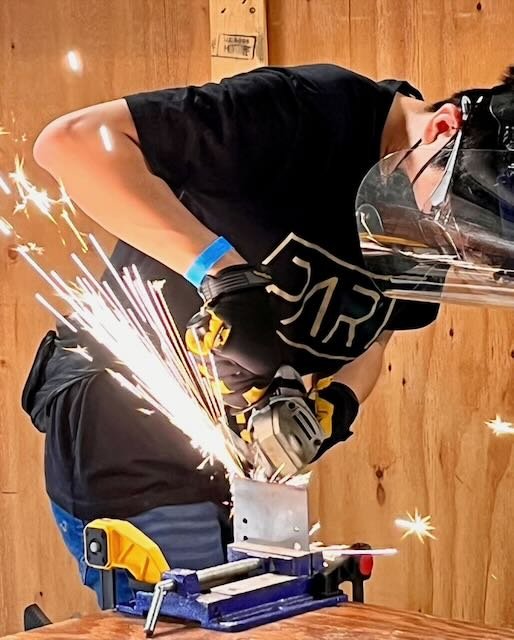
In order to click on silver lock in this screenshot , I will do `click(158, 620)`.